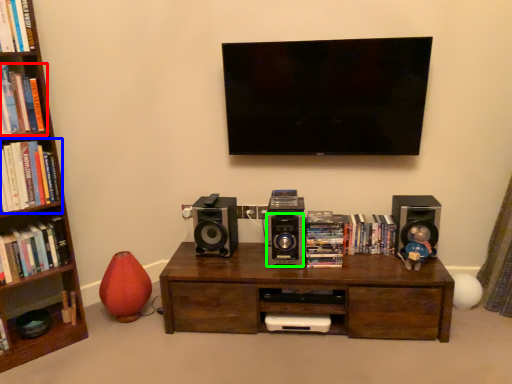
Question: Estimate the real-world distances between objects in this image. Which object is closer to book (highlighted by a red box), book (highlighted by a blue box) or speaker (highlighted by a green box)?

Choices:
 (A) book
 (B) speaker

Answer: (A)